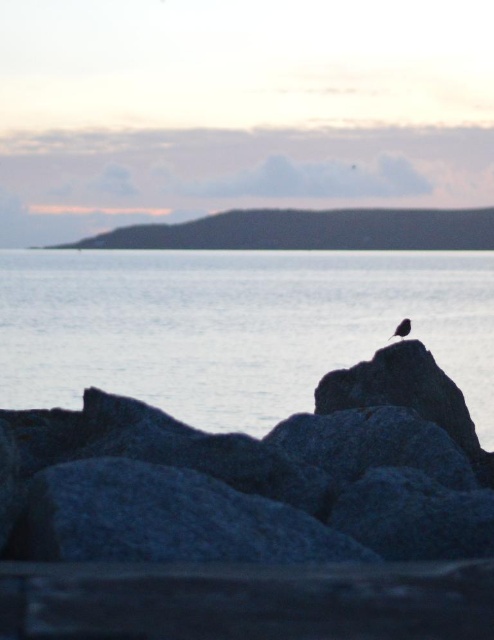
Question: Which object is farther from the camera taking this photo?

Choices:
 (A) silvery metallic bird at center
 (B) gray rough rock at center
 (C) blue water at center

Answer: (A)

Question: Can you confirm if gray rough rock at center is wider than blue water at center?

Choices:
 (A) no
 (B) yes

Answer: (A)

Question: Which of the following is the closest to the observer?

Choices:
 (A) click(406, 324)
 (B) click(7, 598)

Answer: (B)

Question: Does gray rough rock at center have a larger size compared to blue water at center?

Choices:
 (A) no
 (B) yes

Answer: (A)

Question: Can you confirm if blue water at center is positioned to the left of silvery metallic bird at center?

Choices:
 (A) yes
 (B) no

Answer: (A)

Question: Which is nearer to the gray rough rock at center?

Choices:
 (A) silvery metallic bird at center
 (B) blue water at center

Answer: (A)